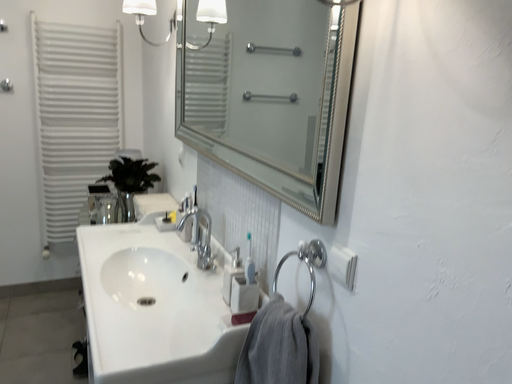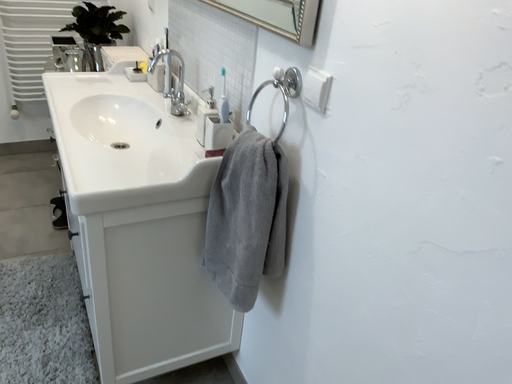
Question: How did the camera likely rotate when shooting the video?

Choices:
 (A) rotated downward
 (B) rotated upward

Answer: (A)